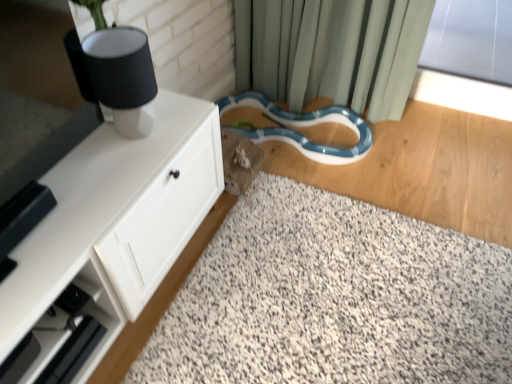
What do you see at coordinates (123, 77) in the screenshot?
I see `black matte table lamp at upper left` at bounding box center [123, 77].

This screenshot has width=512, height=384. I want to click on black matte table lamp at upper left, so click(x=123, y=77).

The width and height of the screenshot is (512, 384). What do you see at coordinates (301, 126) in the screenshot? I see `blue glossy snake at lower center` at bounding box center [301, 126].

This screenshot has height=384, width=512. In order to click on white speckled carpet at center in this screenshot , I will do `click(334, 299)`.

What is the approximate width of white speckled carpet at center?

white speckled carpet at center is 3.49 feet in width.

At what (x,y) coordinates should I click in order to perform the action: click on black matte table lamp at upper left. Please return your answer as a coordinate pair (x, y). Looking at the image, I should click on (123, 77).

Can you confirm if white matte cabinet at left is wider than blue glossy snake at lower center?

No, white matte cabinet at left is not wider than blue glossy snake at lower center.

From the picture: Is white matte cabinet at left oriented towards blue glossy snake at lower center?

No, white matte cabinet at left is not facing towards blue glossy snake at lower center.

Can you confirm if white matte cabinet at left is positioned to the left of blue glossy snake at lower center?

Correct, you'll find white matte cabinet at left to the left of blue glossy snake at lower center.

From a real-world perspective, is white matte cabinet at left over blue glossy snake at lower center?

Yes, from a real-world perspective, white matte cabinet at left is above blue glossy snake at lower center.

Can you confirm if blue glossy snake at lower center is wider than white speckled carpet at center?

No.

Which of these two, blue glossy snake at lower center or white speckled carpet at center, stands taller?

With more height is white speckled carpet at center.

From a real-world perspective, is blue glossy snake at lower center above or below white speckled carpet at center?

blue glossy snake at lower center is below white speckled carpet at center.

What's the angular difference between blue glossy snake at lower center and white speckled carpet at center's facing directions?

The angular difference between blue glossy snake at lower center and white speckled carpet at center is 6.26 degrees.

Could you tell me if white matte cabinet at left is facing black matte table lamp at upper left?

No.

Would you say white matte cabinet at left is inside or outside black matte table lamp at upper left?

white matte cabinet at left lies outside black matte table lamp at upper left.

Considering the positions of objects white matte cabinet at left and black matte table lamp at upper left in the image provided, who is more to the left, white matte cabinet at left or black matte table lamp at upper left?

From the viewer's perspective, white matte cabinet at left appears more on the left side.

I want to click on snake directly beneath the black matte table lamp at upper left (from a real-world perspective), so click(301, 126).

Can you confirm if black matte table lamp at upper left is positioned to the left of blue glossy snake at lower center?

Correct, you'll find black matte table lamp at upper left to the left of blue glossy snake at lower center.

From the image's perspective, is black matte table lamp at upper left beneath blue glossy snake at lower center?

Yes, from the image's perspective, black matte table lamp at upper left is below blue glossy snake at lower center.

Relative to blue glossy snake at lower center, is black matte table lamp at upper left in front or behind?

black matte table lamp at upper left is positioned closer to the viewer than blue glossy snake at lower center.

In the image, is black matte table lamp at upper left positioned in front of or behind white matte cabinet at left?

Visually, black matte table lamp at upper left is located behind white matte cabinet at left.

Is white matte cabinet at left at the back of black matte table lamp at upper left?

black matte table lamp at upper left does not have its back to white matte cabinet at left.

Can you confirm if black matte table lamp at upper left is wider than white matte cabinet at left?

In fact, black matte table lamp at upper left might be narrower than white matte cabinet at left.

From the image's perspective, which one is positioned higher, black matte table lamp at upper left or white matte cabinet at left?

From the image's view, black matte table lamp at upper left is above.

From a real-world perspective, which object rests below the other?

white speckled carpet at center, from a real-world perspective.

Considering the relative positions of white speckled carpet at center and black matte table lamp at upper left in the image provided, is white speckled carpet at center to the right of black matte table lamp at upper left from the viewer's perspective?

Indeed, white speckled carpet at center is positioned on the right side of black matte table lamp at upper left.

From the image's perspective, is white speckled carpet at center on top of black matte table lamp at upper left?

Actually, white speckled carpet at center appears below black matte table lamp at upper left in the image.

How far apart are white speckled carpet at center and black matte table lamp at upper left?

A distance of 30.72 inches exists between white speckled carpet at center and black matte table lamp at upper left.

The height and width of the screenshot is (384, 512). Find the location of `gravel lying on the right of black matte table lamp at upper left`. gravel lying on the right of black matte table lamp at upper left is located at coordinates (334, 299).

Is black matte table lamp at upper left with white speckled carpet at center?

black matte table lamp at upper left and white speckled carpet at center are not in contact.

Considering the points (126, 95) and (476, 329), which point is in front, point (126, 95) or point (476, 329)?

The point (126, 95) is closer.

Which is more to the left, black matte table lamp at upper left or white speckled carpet at center?

black matte table lamp at upper left is more to the left.

The height and width of the screenshot is (384, 512). What are the coordinates of `cabinetry that appears above the blue glossy snake at lower center (from a real-world perspective)` in the screenshot? It's located at (100, 235).

The image size is (512, 384). Identify the location of gravel on the right of blue glossy snake at lower center. (334, 299).

Estimate the real-world distances between objects in this image. Which object is further from black matte table lamp at upper left, white speckled carpet at center or white matte cabinet at left?

white speckled carpet at center is positioned further to the anchor black matte table lamp at upper left.

Based on their spatial positions, is white matte cabinet at left or black matte table lamp at upper left closer to white speckled carpet at center?

white matte cabinet at left is closer to white speckled carpet at center.

Which object lies further to the anchor point white matte cabinet at left, blue glossy snake at lower center or black matte table lamp at upper left?

Based on the image, blue glossy snake at lower center appears to be further to white matte cabinet at left.

Estimate the real-world distances between objects in this image. Which object is further from white matte cabinet at left, white speckled carpet at center or blue glossy snake at lower center?

Among the two, blue glossy snake at lower center is located further to white matte cabinet at left.

Which object lies further to the anchor point white speckled carpet at center, blue glossy snake at lower center or black matte table lamp at upper left?

black matte table lamp at upper left.

Which object lies nearer to the anchor point blue glossy snake at lower center, white matte cabinet at left or black matte table lamp at upper left?

white matte cabinet at left lies closer to blue glossy snake at lower center than the other object.

From the image, which object appears to be farther from white speckled carpet at center, black matte table lamp at upper left or white matte cabinet at left?

black matte table lamp at upper left is further to white speckled carpet at center.

Based on their spatial positions, is white matte cabinet at left or white speckled carpet at center closer to blue glossy snake at lower center?

Based on the image, white speckled carpet at center appears to be nearer to blue glossy snake at lower center.

Identify the location of table lamp between white speckled carpet at center and blue glossy snake at lower center along the z-axis. (123, 77).

This screenshot has height=384, width=512. I want to click on table lamp positioned between white matte cabinet at left and blue glossy snake at lower center from near to far, so click(x=123, y=77).

Where is `gravel positioned between white matte cabinet at left and blue glossy snake at lower center from near to far`? Image resolution: width=512 pixels, height=384 pixels. gravel positioned between white matte cabinet at left and blue glossy snake at lower center from near to far is located at coordinates (334, 299).

This screenshot has width=512, height=384. I want to click on table lamp between white matte cabinet at left and white speckled carpet at center from left to right, so click(123, 77).